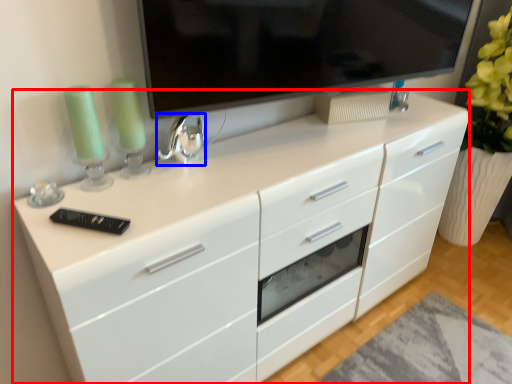
Question: Which object appears farthest to the camera in this image, chest of drawers (highlighted by a red box) or appliance (highlighted by a blue box)?

Choices:
 (A) chest of drawers
 (B) appliance

Answer: (B)